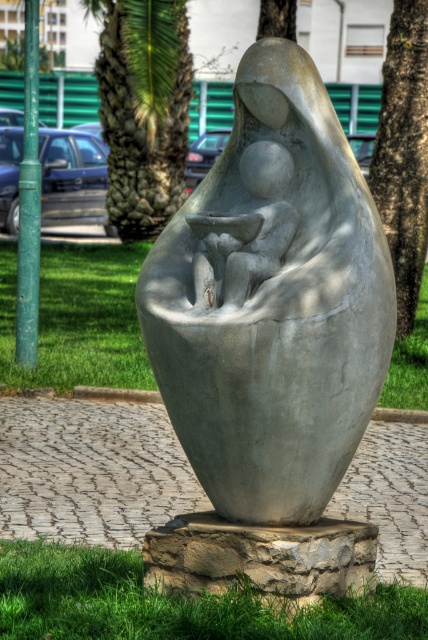
Question: Which object is positioned farthest from the green grass at base?

Choices:
 (A) matte gray stone baby at center
 (B) gray stone sculpture at center
 (C) green leafy palm tree at center
 (D) green grass at center

Answer: (C)

Question: Which point is farther to the camera?

Choices:
 (A) (225, 225)
 (B) (140, 234)
 (C) (264, 515)
 (D) (291, 1)

Answer: (B)

Question: Which object is closer to the camera taking this photo?

Choices:
 (A) smooth bark tree at center
 (B) matte gray stone baby at center
 (C) green leafy palm tree at center

Answer: (B)

Question: Considering the relative positions of matte gray stone baby at center and green leafy tree at upper center in the image provided, where is matte gray stone baby at center located with respect to green leafy tree at upper center?

Choices:
 (A) below
 (B) above

Answer: (A)

Question: Does gray stone sculpture at center appear on the right side of green grass at base?

Choices:
 (A) no
 (B) yes

Answer: (B)

Question: Can you confirm if green grass at base is positioned above smooth bark tree at center?

Choices:
 (A) no
 (B) yes

Answer: (A)